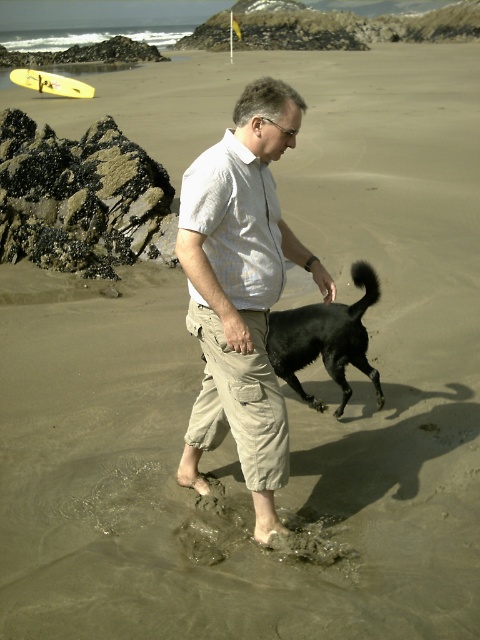
You are a photographer standing at the edge of the beach. You want to take a photo of the light beige cotton shirt at center while keeping your camera in hand. Can you reach the camera without moving your position?

The light beige cotton shirt at center and camera are 2.65 meters apart. Since the distance between them is more than an average person can reach, you cannot reach the camera while staying in place.

You are a photographer trying to capture the man and his dog in the scene. The light beige cotton shirt at center is at point 0.456, 0.504. If you want to frame the shot so that the shirt is centered in the photo, where should you position your camera? Please provide coordinates in the format of x,y where x and y are between 0 and 1.

To center the light beige cotton shirt at center, position the camera at coordinates (241, 291).

You are a photographer trying to capture a photo of the light beige cotton shirt at center and the black matte dog at lower center. You want to ensure both subjects are in focus. Given that your camera has a depth of field range of 28 inches, will you be able to achieve this?

The light beige cotton shirt at center is 29.69 inches from the black matte dog at lower center. Since the distance between them exceeds the camera depth of field range of 28 inches, it will be challenging to have both subjects in focus simultaneously.